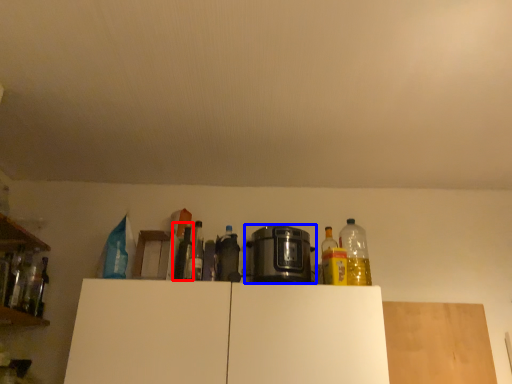
Question: Which of the following is the closest to the observer, bottle (highlighted by a red box) or home appliance (highlighted by a blue box)?

Choices:
 (A) bottle
 (B) home appliance

Answer: (B)